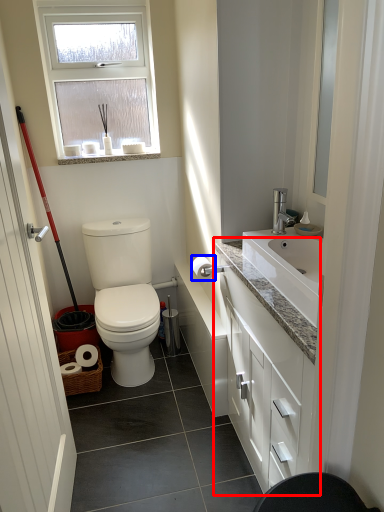
Question: Which point is closer to the camera, bathroom cabinet (highlighted by a red box) or toilet paper (highlighted by a blue box)?

Choices:
 (A) bathroom cabinet
 (B) toilet paper

Answer: (A)